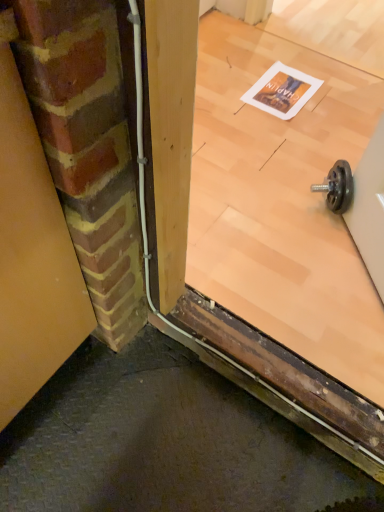
Question: Can you confirm if matte yellow garage door at left is shorter than transparent glass door at center?

Choices:
 (A) no
 (B) yes

Answer: (A)

Question: Can you confirm if matte yellow garage door at left is taller than transparent glass door at center?

Choices:
 (A) yes
 (B) no

Answer: (A)

Question: Is matte yellow garage door at left further to camera compared to transparent glass door at center?

Choices:
 (A) yes
 (B) no

Answer: (B)

Question: From the image's perspective, would you say matte yellow garage door at left is positioned over transparent glass door at center?

Choices:
 (A) no
 (B) yes

Answer: (A)

Question: Considering the relative sizes of matte yellow garage door at left and transparent glass door at center in the image provided, is matte yellow garage door at left smaller than transparent glass door at center?

Choices:
 (A) no
 (B) yes

Answer: (B)

Question: Is matte yellow garage door at left at the left side of transparent glass door at center?

Choices:
 (A) no
 (B) yes

Answer: (B)

Question: Is transparent glass door at center oriented towards matte yellow garage door at left?

Choices:
 (A) no
 (B) yes

Answer: (B)

Question: Can you confirm if transparent glass door at center is bigger than matte yellow garage door at left?

Choices:
 (A) no
 (B) yes

Answer: (B)

Question: Is transparent glass door at center to the left of matte yellow garage door at left from the viewer's perspective?

Choices:
 (A) no
 (B) yes

Answer: (A)

Question: From the image's perspective, is transparent glass door at center under matte yellow garage door at left?

Choices:
 (A) no
 (B) yes

Answer: (A)

Question: Is transparent glass door at center directly adjacent to matte yellow garage door at left?

Choices:
 (A) no
 (B) yes

Answer: (A)

Question: Can you confirm if transparent glass door at center is smaller than matte yellow garage door at left?

Choices:
 (A) yes
 (B) no

Answer: (B)

Question: In terms of width, does matte yellow garage door at left look wider or thinner when compared to transparent glass door at center?

Choices:
 (A) wide
 (B) thin

Answer: (B)